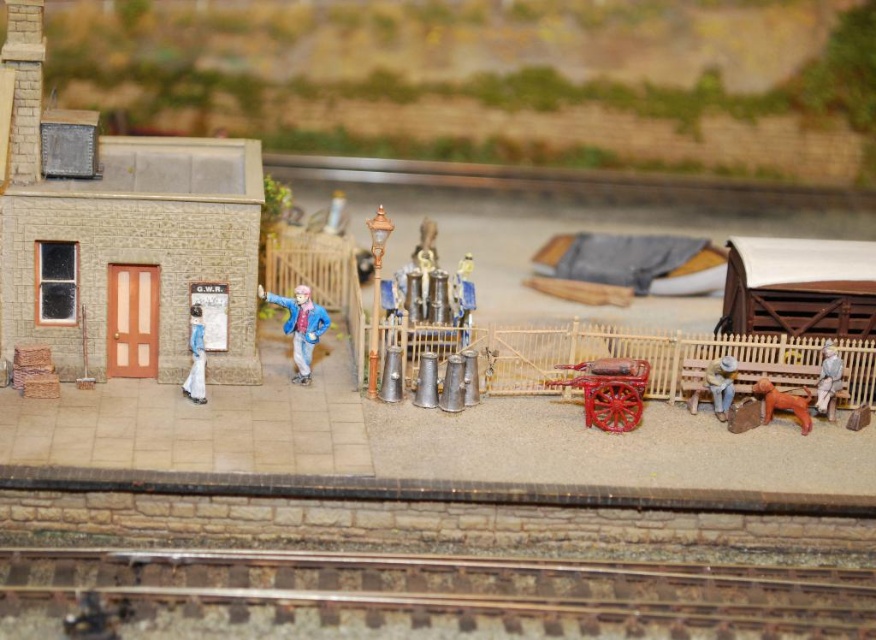
Consider the image. You are a visitor at the G.W.R. station and want to sit down. There is a brown wooden bench at right and a wooden figure at right nearby. Which one is closer to you?

The brown wooden bench at right is closer to the viewer than the wooden figure at right, so you should choose the bench to sit down.

In the miniature railway station diorama, you notice two figures dressed in period clothing. One is wearing a matte blue dress at left, and the other is a brown matte dog at lower right. From the perspective of an observer looking at the scene, which figure is positioned higher up?

The matte blue dress at left is positioned higher up than the brown matte dog at lower right, as it is located above it in the scene.